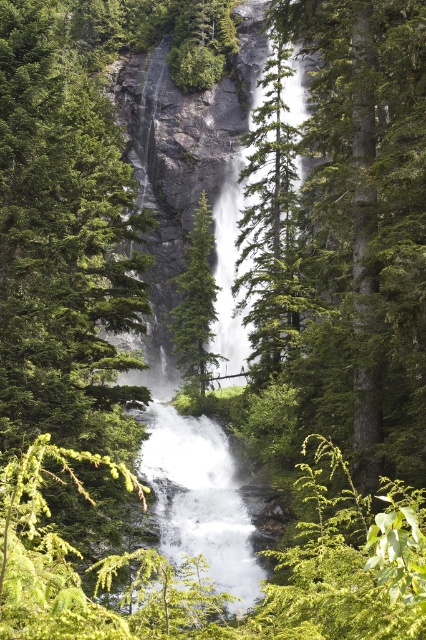
Question: Does green textured tree at center appear on the left side of white frothy water at center?

Choices:
 (A) no
 (B) yes

Answer: (A)

Question: Among these objects, which one is nearest to the camera?

Choices:
 (A) green matte tree at center
 (B) green textured tree at center
 (C) white frothy water at center

Answer: (C)

Question: Which of the following is the closest to the observer?

Choices:
 (A) green matte tree at center
 (B) white frothy water at center
 (C) green textured tree at center

Answer: (B)

Question: Is green textured tree at center to the left of white frothy water at center from the viewer's perspective?

Choices:
 (A) no
 (B) yes

Answer: (A)

Question: Is green textured tree at center positioned behind green matte tree at center?

Choices:
 (A) no
 (B) yes

Answer: (A)

Question: Considering the real-world distances, which object is farthest from the green matte tree at center?

Choices:
 (A) green textured tree at center
 (B) white frothy water at center

Answer: (B)